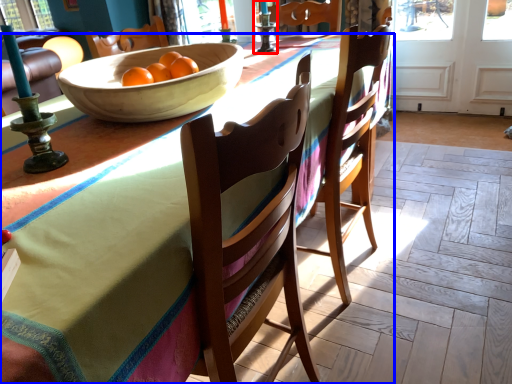
Question: Among these objects, which one is nearest to the camera, candle holder (highlighted by a red box) or desk (highlighted by a blue box)?

Choices:
 (A) candle holder
 (B) desk

Answer: (B)